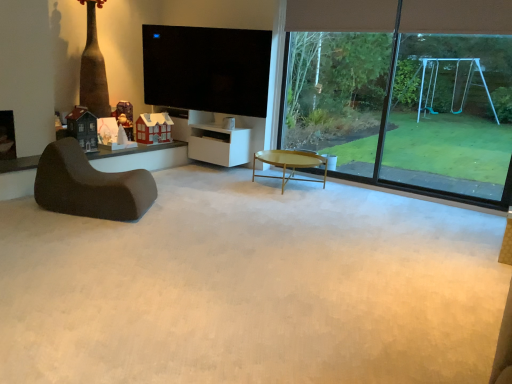
At what (x,y) coordinates should I click in order to perform the action: click on vacant space to the right of dark brown fabric chair at left. Please return your answer as a coordinate pair (x, y). The image size is (512, 384). Looking at the image, I should click on (183, 214).